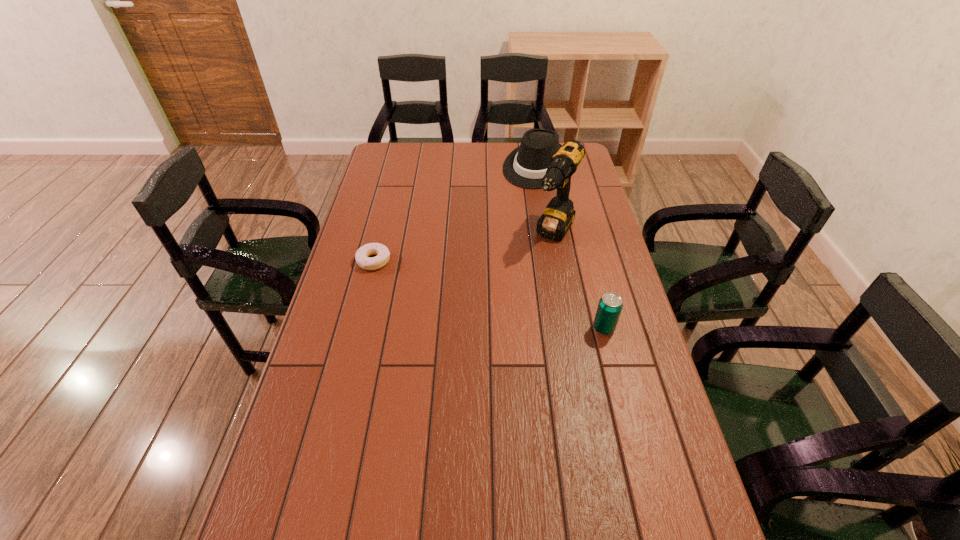
In the image, there is a desktop. Where is `vacant space at the near edge`? The height and width of the screenshot is (540, 960). vacant space at the near edge is located at coordinates (365, 524).

The height and width of the screenshot is (540, 960). In the image, there is a desktop. Identify the location of free space at the left edge. (355, 350).

At what (x,y) coordinates should I click in order to perform the action: click on free space at the right edge of the desktop. Please return your answer as a coordinate pair (x, y). The width and height of the screenshot is (960, 540). Looking at the image, I should click on (625, 307).

Where is `free location at the far left corner`? This screenshot has width=960, height=540. free location at the far left corner is located at coordinates (398, 143).

The width and height of the screenshot is (960, 540). I want to click on free space between the shortest object and the beer can, so click(489, 294).

Where is `empty space that is in between the tallest object and the fedora`? empty space that is in between the tallest object and the fedora is located at coordinates pyautogui.click(x=546, y=200).

Where is `vacant space that's between the drill and the beer can`? The image size is (960, 540). vacant space that's between the drill and the beer can is located at coordinates (579, 281).

The width and height of the screenshot is (960, 540). In order to click on empty location between the fedora and the doughnut in this screenshot , I will do `click(456, 213)`.

The width and height of the screenshot is (960, 540). Identify the location of free spot between the fedora and the tallest object. pos(546,200).

I want to click on vacant space in between the drill and the doughnut, so click(465, 247).